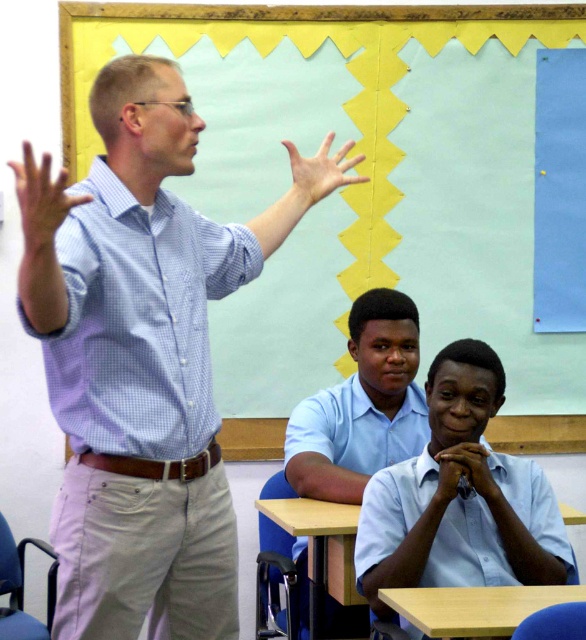
Can you confirm if light brown wooden table at lower center is smaller than matte skin hand at center?

No, light brown wooden table at lower center is not smaller than matte skin hand at center.

Which is in front, point (404, 605) or point (346, 168)?

Point (404, 605) is in front.

Does point (512, 628) lie in front of point (298, 204)?

Yes, point (512, 628) is in front of point (298, 204).

Find the location of a particular element. Image resolution: width=586 pixels, height=640 pixels. light brown wooden table at lower center is located at coordinates (475, 608).

Between blue checkered shirt at upper left and light brown wooden table at lower center, which one appears on the right side from the viewer's perspective?

From the viewer's perspective, light brown wooden table at lower center appears more on the right side.

Consider the image. Does blue checkered shirt at upper left appear under light brown wooden table at lower center?

No, blue checkered shirt at upper left is not below light brown wooden table at lower center.

Identify the location of blue checkered shirt at upper left. The image size is (586, 640). (141, 369).

Which is above, matte blue shirt at upper left or matte skin hand at center?

matte skin hand at center is above.

Does matte blue shirt at upper left have a lesser width compared to matte skin hand at center?

Yes.

Which is in front, point (56, 205) or point (291, 192)?

Point (56, 205) is more forward.

Locate an element on the screen. matte blue shirt at upper left is located at coordinates (40, 200).